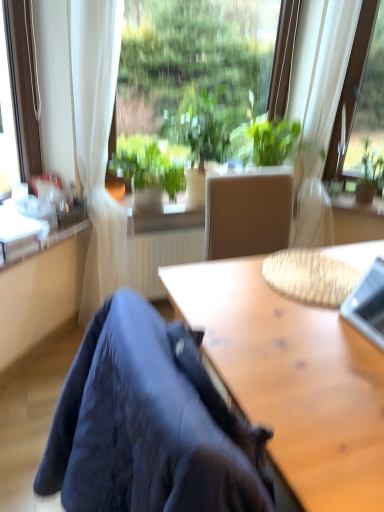
Question: Considering the relative positions of transparent glass window at upper right, marked as the 2th window in a left-to-right arrangement, and silver metallic laptop at upper right in the image provided, is transparent glass window at upper right, marked as the 2th window in a left-to-right arrangement, behind silver metallic laptop at upper right?

Choices:
 (A) yes
 (B) no

Answer: (A)

Question: Does transparent glass window at upper right, placed as the 1th window when sorted from right to left, have a lesser height compared to silver metallic laptop at upper right?

Choices:
 (A) yes
 (B) no

Answer: (B)

Question: Is transparent glass window at upper right, marked as the 2th window in a left-to-right arrangement, taller than silver metallic laptop at upper right?

Choices:
 (A) no
 (B) yes

Answer: (B)

Question: Could you tell me if transparent glass window at upper right, placed as the 1th window when sorted from right to left, is turned towards silver metallic laptop at upper right?

Choices:
 (A) yes
 (B) no

Answer: (A)

Question: Can you confirm if transparent glass window at upper right, marked as the 2th window in a left-to-right arrangement, is wider than silver metallic laptop at upper right?

Choices:
 (A) yes
 (B) no

Answer: (B)

Question: Is silver metallic laptop at upper right inside transparent glass window at upper right, marked as the 2th window in a left-to-right arrangement?

Choices:
 (A) yes
 (B) no

Answer: (B)

Question: Considering the relative sizes of green leafy plant at center, which is the second houseplant in left-to-right order, and green leafy plant at center, marked as the 3th houseplant in a right-to-left arrangement, in the image provided, is green leafy plant at center, which is the second houseplant in left-to-right order, thinner than green leafy plant at center, marked as the 3th houseplant in a right-to-left arrangement,?

Choices:
 (A) no
 (B) yes

Answer: (A)

Question: Can you confirm if green leafy plant at center, which appears as the 2th houseplant when viewed from the right, is positioned to the right of green leafy plant at center, positioned as the 1th houseplant in left-to-right order?

Choices:
 (A) yes
 (B) no

Answer: (A)

Question: Does green leafy plant at center, which appears as the 2th houseplant when viewed from the right, have a lesser height compared to green leafy plant at center, marked as the 3th houseplant in a right-to-left arrangement?

Choices:
 (A) yes
 (B) no

Answer: (B)

Question: Is green leafy plant at center, which is the second houseplant in left-to-right order, outside green leafy plant at center, marked as the 3th houseplant in a right-to-left arrangement?

Choices:
 (A) yes
 (B) no

Answer: (A)

Question: Does green leafy plant at center, which is the second houseplant in left-to-right order, have a greater width compared to green leafy plant at center, marked as the 3th houseplant in a right-to-left arrangement?

Choices:
 (A) yes
 (B) no

Answer: (A)

Question: Are green leafy plant at center, which appears as the 2th houseplant when viewed from the right, and green leafy plant at center, marked as the 3th houseplant in a right-to-left arrangement, beside each other?

Choices:
 (A) yes
 (B) no

Answer: (B)

Question: Is silver metallic laptop at upper right looking in the opposite direction of green leafy plant at upper right, marked as the first houseplant in a right-to-left arrangement?

Choices:
 (A) yes
 (B) no

Answer: (B)